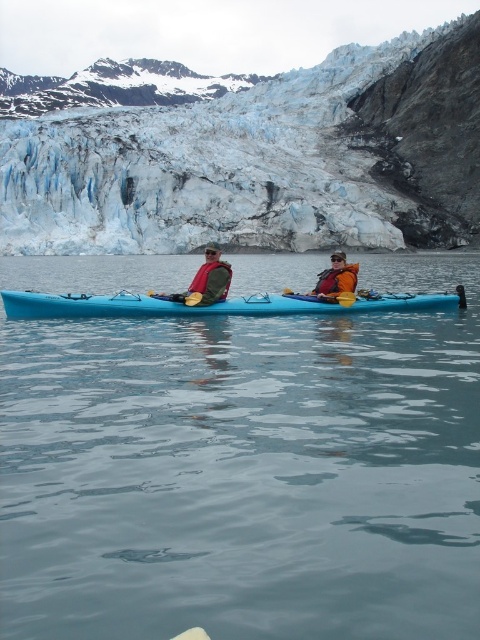
Question: Which point is closer to the camera?

Choices:
 (A) matte green jacket at center
 (B) matte green life jacket at center

Answer: (A)

Question: Does blue ice glacier at upper center appear on the left side of matte green jacket at center?

Choices:
 (A) yes
 (B) no

Answer: (A)

Question: Which point is farther to the camera?

Choices:
 (A) clear water at center
 (B) blue plastic canoe at center
 (C) orange fleece jacket at center
 (D) matte green life jacket at center

Answer: (C)

Question: Among these points, which one is farthest from the camera?

Choices:
 (A) (333, 298)
 (B) (331, 292)

Answer: (B)

Question: Can you confirm if blue ice glacier at upper center is thinner than orange fleece jacket at center?

Choices:
 (A) yes
 (B) no

Answer: (B)

Question: Is clear water at center above blue ice glacier at upper center?

Choices:
 (A) no
 (B) yes

Answer: (A)